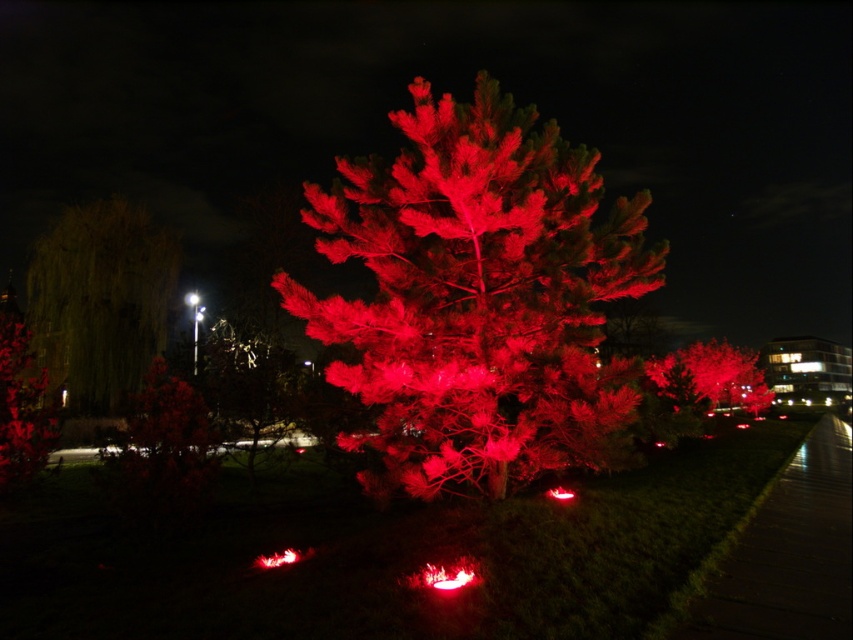
Who is more forward, [425,480] or [54,436]?

Point [425,480] is more forward.

Which is behind, point (618, 406) or point (33, 449)?

Point (33, 449)

Does point (376, 353) come farther from viewer compared to point (0, 392)?

No, (376, 353) is closer to viewer.

Identify the location of red illuminated pine tree at center. (477, 298).

Does red illuminated pine tree at center appear over smooth bark willow at left?

No, red illuminated pine tree at center is not above smooth bark willow at left.

Between red illuminated pine tree at center and smooth bark willow at left, which one has more height?

With more height is smooth bark willow at left.

Who is more distant from viewer, (x=413, y=481) or (x=160, y=332)?

The point (x=160, y=332) is behind.

Identify the location of red illuminated pine tree at center. The image size is (853, 640). (477, 298).

Who is taller, smooth bark willow at left or shiny metallic sculpture at center?

smooth bark willow at left

Between point (71, 340) and point (225, 348), which one is positioned in front?

Positioned in front is point (225, 348).

Where is `smooth bark willow at left`? smooth bark willow at left is located at coordinates (100, 301).